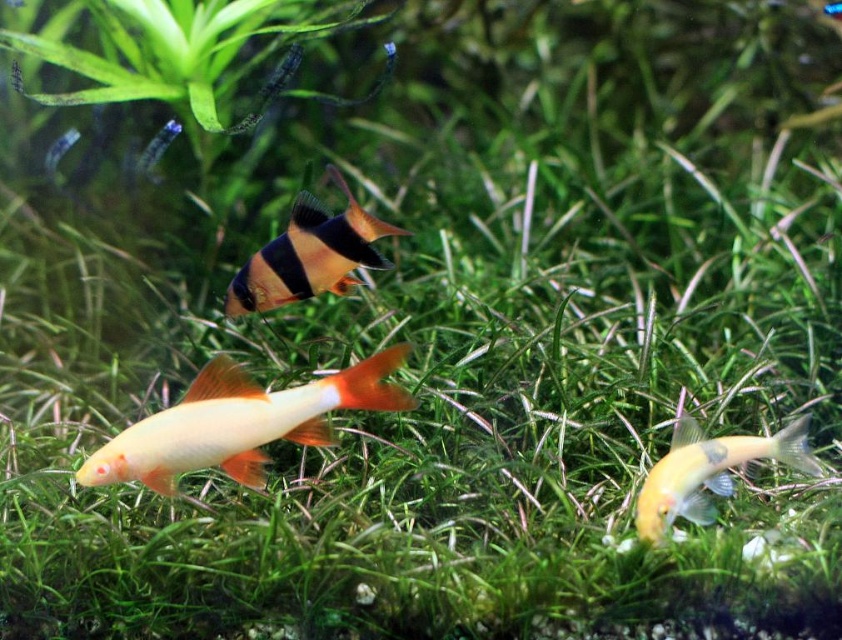
Who is higher up, black and orange striped fish at center or shiny yellow fish at lower right?

black and orange striped fish at center is higher up.

Can you confirm if black and orange striped fish at center is thinner than shiny yellow fish at lower right?

No.

Identify the location of black and orange striped fish at center. (308, 253).

Is point (276, 438) closer to viewer compared to point (232, 314)?

No, it is not.

What do you see at coordinates (238, 422) in the screenshot? I see `shiny orange fish at center` at bounding box center [238, 422].

What do you see at coordinates (238, 422) in the screenshot? I see `shiny orange fish at center` at bounding box center [238, 422].

At what (x,y) coordinates should I click in order to perform the action: click on shiny orange fish at center. Please return your answer as a coordinate pair (x, y). The image size is (842, 640). Looking at the image, I should click on (238, 422).

Does shiny orange fish at center come in front of shiny yellow fish at lower right?

Yes, it is in front of shiny yellow fish at lower right.

Between shiny orange fish at center and shiny yellow fish at lower right, which one appears on the left side from the viewer's perspective?

shiny orange fish at center is more to the left.

Does point (308, 387) come closer to viewer compared to point (777, 440)?

Yes, it is.

Find the location of `shiny orange fish at center`. shiny orange fish at center is located at coordinates (238, 422).